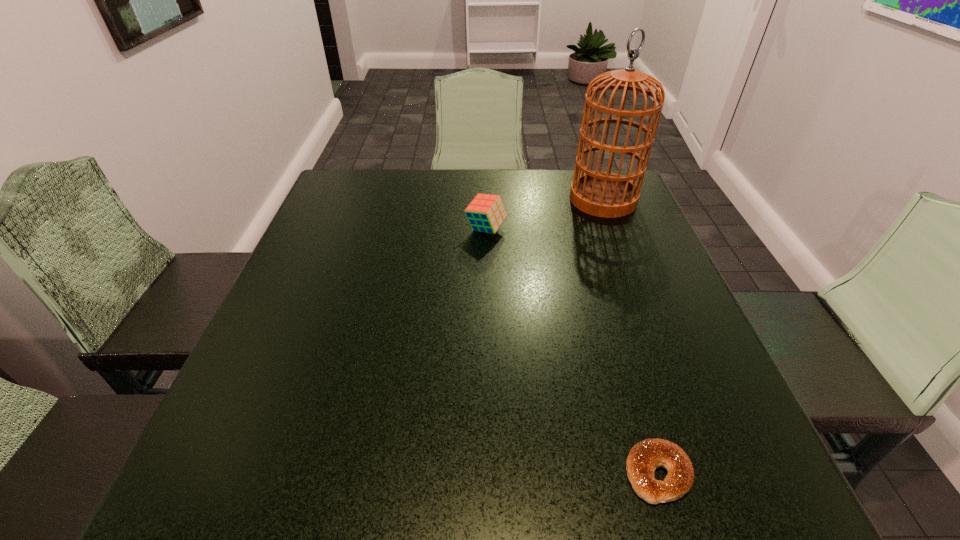
At what (x,y) coordinates should I click in order to perform the action: click on object that is at the near edge. Please return your answer as a coordinate pair (x, y). Looking at the image, I should click on (643, 459).

Identify the location of birdcage located at the right edge. (603, 194).

Identify the location of bagel that is at the right edge. (643, 459).

Find the location of a particular element. Image resolution: width=960 pixels, height=540 pixels. object at the far right corner is located at coordinates (603, 194).

You are a GUI agent. You are given a task and a screenshot of the screen. Output one action in this format:
    pyautogui.click(x=<x>, y=<y>)
    Task: Click on the object at the near right corner
    
    Given the screenshot: What is the action you would take?
    pyautogui.click(x=643, y=459)

The width and height of the screenshot is (960, 540). I want to click on vacant area at the far edge, so click(413, 170).

The height and width of the screenshot is (540, 960). I want to click on blank space at the near edge of the desktop, so click(x=322, y=507).

In the image, there is a desktop. Identify the location of free space at the left edge. (337, 234).

Where is `vacant space at the right edge`? vacant space at the right edge is located at coordinates (664, 435).

I want to click on free space at the far left corner of the desktop, so click(x=366, y=191).